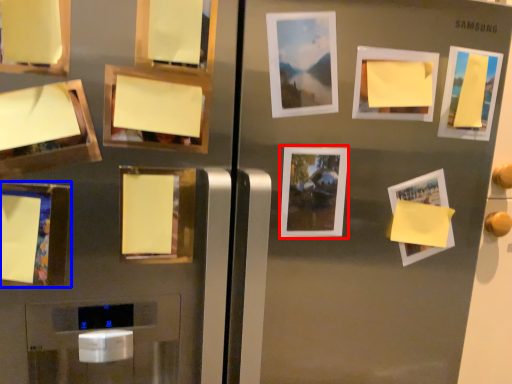
Question: Among these objects, which one is nearest to the camera, picture frame (highlighted by a red box) or picture frame (highlighted by a blue box)?

Choices:
 (A) picture frame
 (B) picture frame

Answer: (B)